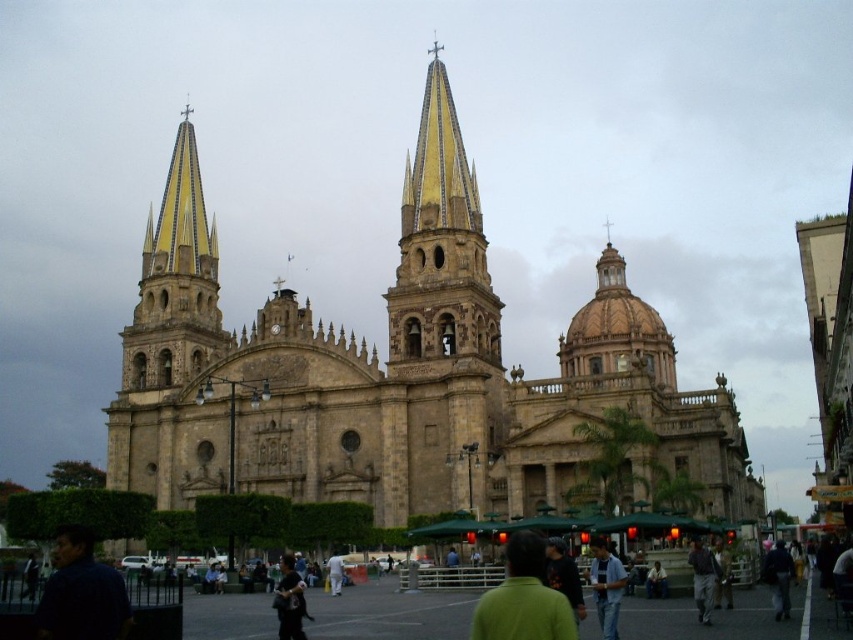
You are standing in the plaza in front of the cathedral. You notice the beige stone church at center and the dark blue shirt at center. Which object is positioned to the left of the other?

The dark blue shirt at center is to the left of the beige stone church at center.

You are standing in the plaza in front of the cathedral and notice two people wearing the green matte shirt at lower center and the dark blue jacket at center. Which person is positioned higher relative to the other?

The green matte shirt at lower center is above the dark blue jacket at center, so the person wearing the green matte shirt at lower center is positioned higher.